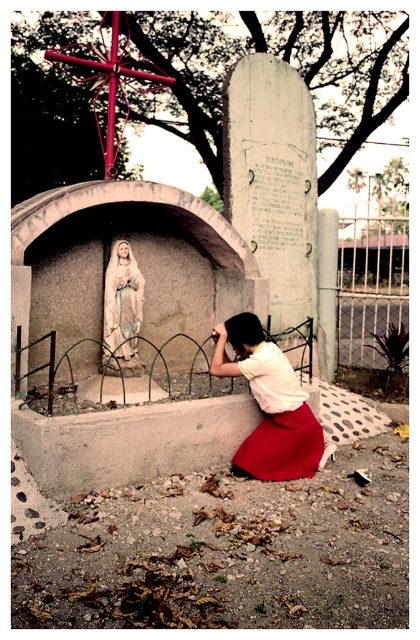
You are a photographer setting up a tripod in front of the shrine. The smooth concrete base at lower center and the matte white blouse at center are both in your shot. Which object appears taller in the photo?

The matte white blouse at center appears taller than the smooth concrete base at lower center because the smooth concrete base at lower center is shorter than matte white blouse at center.

You are a maintenance worker needing to place a 5 feet long protective covering over the smooth concrete base at lower center and the white marble statue at center. Will the covering be long enough to cover both objects?

The smooth concrete base at lower center and the white marble statue at center are 5.13 feet apart. The protective covering is 5 feet long, which is shorter than the distance between them. Therefore, the covering will not be long enough to cover both objects.

You are a photographer aiming to capture both the matte white blouse at center and the white marble statue at center in the same frame. Based on their sizes, which object should you focus on first to ensure both are in focus?

The matte white blouse at center is taller than the white marble statue at center, so you should focus on the taller object first to ensure both are in focus.